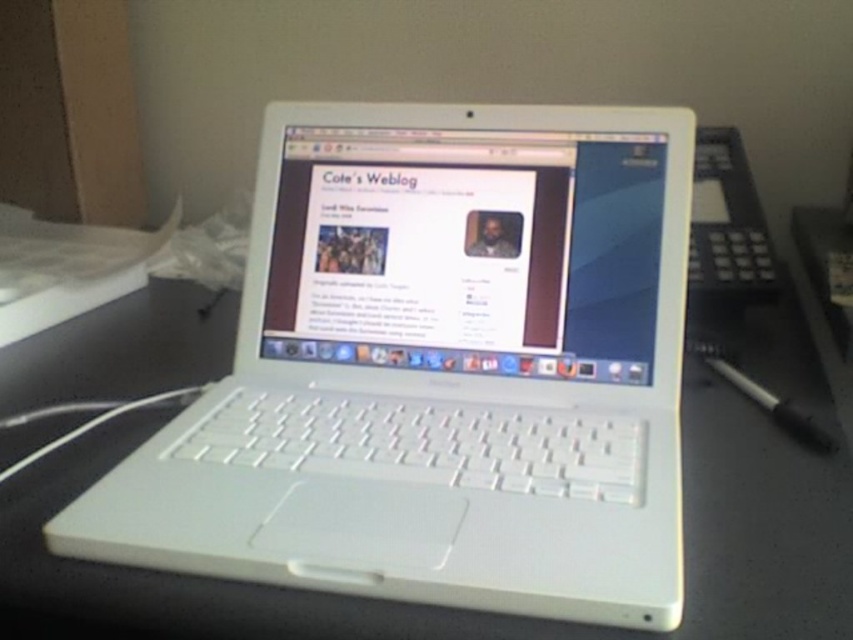
Question: Can you confirm if white plastic laptop at center is bigger than white glossy laptop screen at center?

Choices:
 (A) no
 (B) yes

Answer: (B)

Question: Estimate the real-world distances between objects in this image. Which object is farther from the white glossy laptop screen at center?

Choices:
 (A) white plastic laptop at center
 (B) black plastic pen at lower right

Answer: (B)

Question: Which object appears closest to the camera in this image?

Choices:
 (A) black plastic pen at lower right
 (B) white glossy laptop screen at center

Answer: (A)

Question: Is white plastic laptop at center to the left of white glossy laptop screen at center from the viewer's perspective?

Choices:
 (A) yes
 (B) no

Answer: (A)

Question: Can you confirm if white plastic laptop at center is positioned below black plastic pen at lower right?

Choices:
 (A) no
 (B) yes

Answer: (A)

Question: Among these points, which one is farthest from the camera?

Choices:
 (A) (787, 403)
 (B) (535, 227)

Answer: (B)